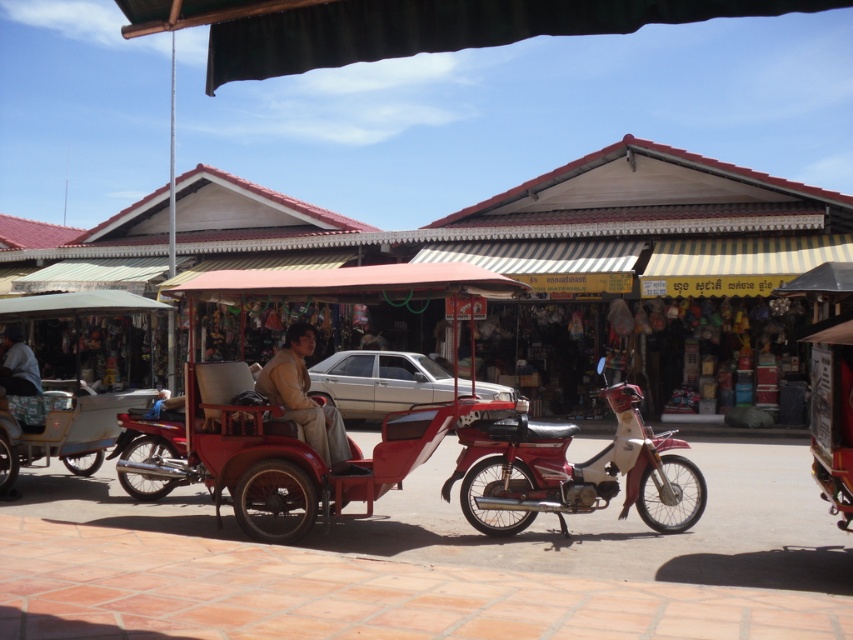
Question: Which object is positioned closest to the brown leather jacket at center?

Choices:
 (A) silver metallic car at center
 (B) dark gray fabric jacket at lower left

Answer: (B)

Question: Does shiny red motorcycle at center appear over silver metallic car at center?

Choices:
 (A) no
 (B) yes

Answer: (A)

Question: Is metallic red tricycle at center bigger than shiny red motorcycle at center?

Choices:
 (A) no
 (B) yes

Answer: (A)

Question: Is shiny red motorcycle at center to the left of brown leather jacket at center from the viewer's perspective?

Choices:
 (A) no
 (B) yes

Answer: (A)

Question: Which object is positioned closest to the silver metallic car at center?

Choices:
 (A) dark gray fabric jacket at lower left
 (B) brown leather jacket at center

Answer: (A)

Question: Which object appears closest to the camera in this image?

Choices:
 (A) dark gray fabric jacket at lower left
 (B) brown leather jacket at center
 (C) silver metallic car at center
 (D) shiny red motorcycle at center

Answer: (D)